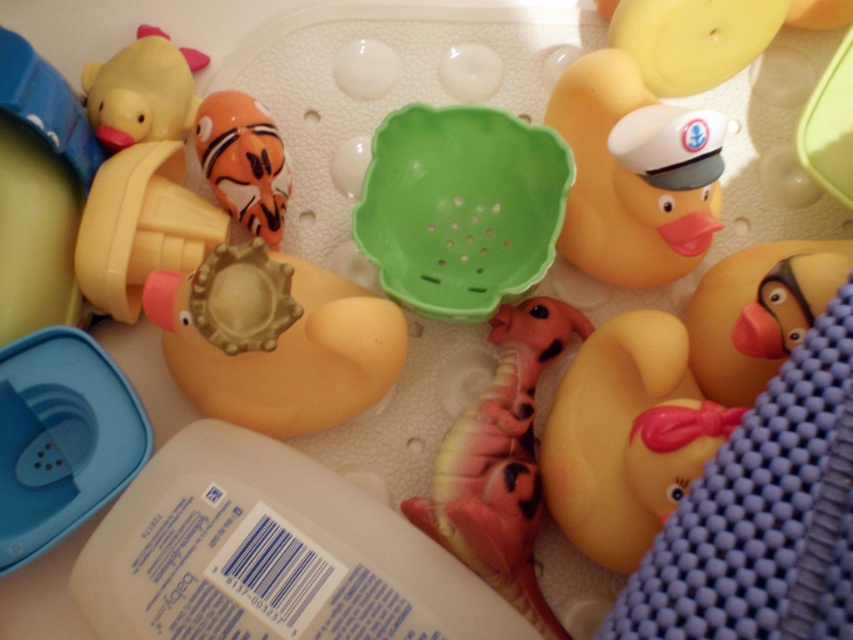
Question: Is pink rubber fish at center closer to the viewer compared to translucent orange fish at center?

Choices:
 (A) yes
 (B) no

Answer: (A)

Question: Where is tan rubber duck at center located in relation to rubber duck at upper left in the image?

Choices:
 (A) right
 (B) left

Answer: (A)

Question: Is the position of yellow rubber duck at center less distant than that of rubber duck at right?

Choices:
 (A) yes
 (B) no

Answer: (A)

Question: Which point is closer to the camera?

Choices:
 (A) pink rubber fish at center
 (B) rubber duck at upper left
 (C) tan rubber duck at center
 (D) translucent orange fish at center

Answer: (C)

Question: Which object appears closest to the camera in this image?

Choices:
 (A) yellow rubber duck at upper right
 (B) translucent orange fish at center
 (C) pink rubber fish at center

Answer: (C)

Question: Among these points, which one is farthest from the camera?

Choices:
 (A) (787, 305)
 (B) (601, 490)

Answer: (B)